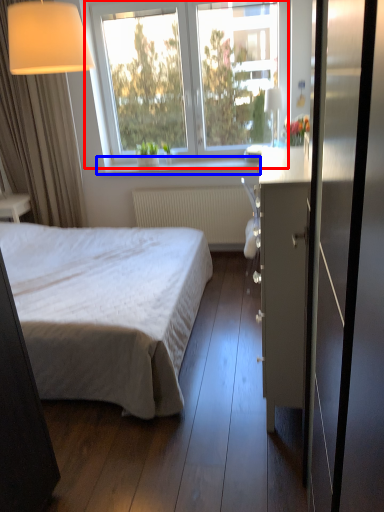
Question: Which object is further to the camera taking this photo, window (highlighted by a red box) or window sill (highlighted by a blue box)?

Choices:
 (A) window
 (B) window sill

Answer: (B)